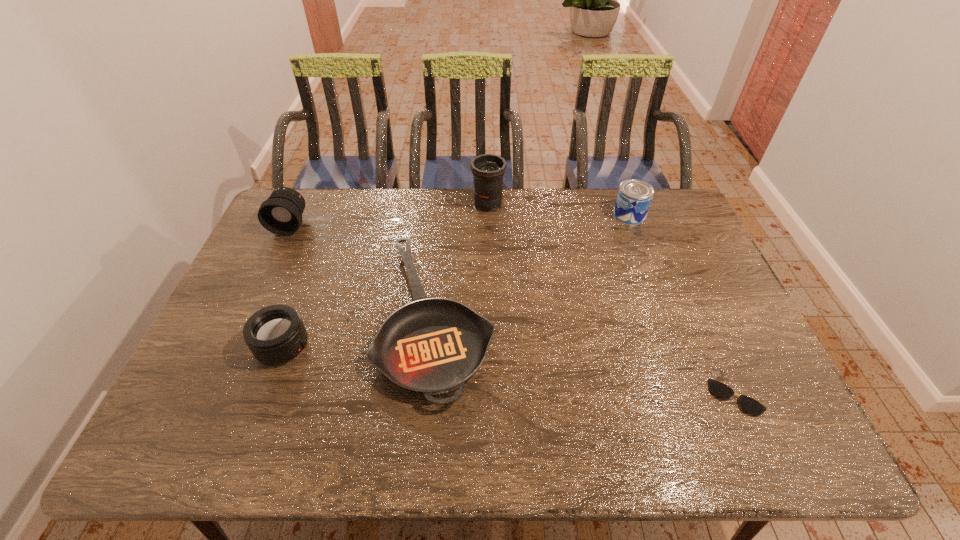
Find the location of a particular element. The width and height of the screenshot is (960, 540). the third closest telephoto lens to the fourth shortest object is located at coordinates (281, 214).

Point out which telephoto lens is positioned as the second nearest to the shortest telephoto lens. Please provide its 2D coordinates. Your answer should be formatted as a tuple, i.e. [(x, y)], where the tuple contains the x and y coordinates of a point satisfying the conditions above.

[(487, 169)]

At what (x,y) coordinates should I click in order to perform the action: click on free location that satisfies the following two spatial constraints: 1. at the front element of the second shortest object; 2. on the left side of the second shortest telephoto lens. Please return your answer as a coordinate pair (x, y). This screenshot has width=960, height=540. Looking at the image, I should click on (247, 318).

Where is `blank area in the image that satisfies the following two spatial constraints: 1. on the front label of the third tallest object; 2. at the front element of the second shortest telephoto lens`? blank area in the image that satisfies the following two spatial constraints: 1. on the front label of the third tallest object; 2. at the front element of the second shortest telephoto lens is located at coordinates point(633,225).

This screenshot has width=960, height=540. In order to click on vacant point that satisfies the following two spatial constraints: 1. on the front side of the shortest object; 2. on the left side of the rightmost telephoto lens in this screenshot , I will do `click(492, 397)`.

Where is `free spot that satisfies the following two spatial constraints: 1. on the side of the shortest telephoto lens with brand markings and control switches; 2. on the left side of the shortest object`? Image resolution: width=960 pixels, height=540 pixels. free spot that satisfies the following two spatial constraints: 1. on the side of the shortest telephoto lens with brand markings and control switches; 2. on the left side of the shortest object is located at coordinates (264, 397).